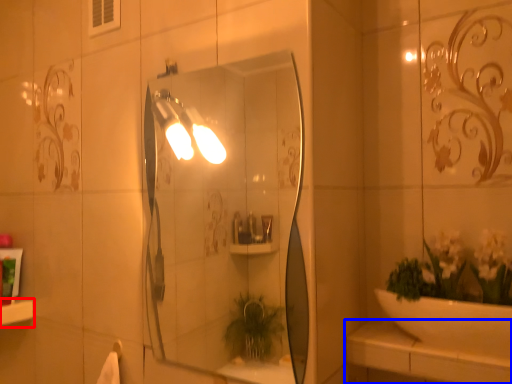
Question: Which of the following is the closest to the observer, ledge (highlighted by a red box) or counter top (highlighted by a blue box)?

Choices:
 (A) ledge
 (B) counter top

Answer: (B)